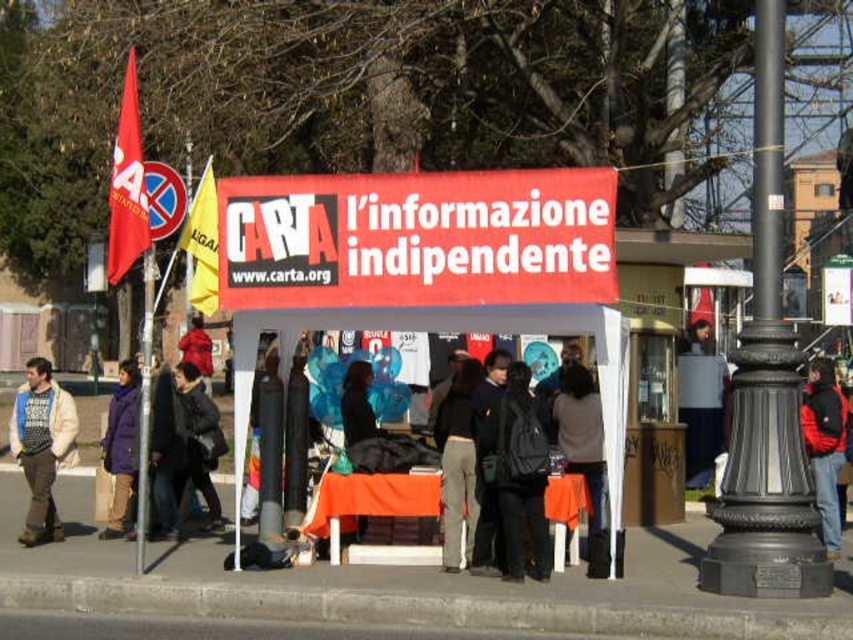
Which is in front, point (194, 483) or point (140, 488)?

Point (140, 488) is more forward.

What are the coordinates of `dark gray jacket at center` in the screenshot? It's located at (199, 440).

Is red fabric sign at center above purple fleece jacket at lower left?

Yes, red fabric sign at center is above purple fleece jacket at lower left.

Image resolution: width=853 pixels, height=640 pixels. What are the coordinates of `red fabric sign at center` in the screenshot? It's located at (416, 237).

Is point (596, 186) positioned in front of point (131, 509)?

Yes, point (596, 186) is closer to viewer.

At what (x,y) coordinates should I click in order to perform the action: click on red fabric sign at center. Please return your answer as a coordinate pair (x, y). Image resolution: width=853 pixels, height=640 pixels. Looking at the image, I should click on (416, 237).

Does dark gray jacket at center appear on the right side of red wool coat at center?

Indeed, dark gray jacket at center is positioned on the right side of red wool coat at center.

Is dark gray jacket at center wider than red wool coat at center?

No.

You are a GUI agent. You are given a task and a screenshot of the screen. Output one action in this format:
    pyautogui.click(x=<x>, y=<y>)
    Task: Click on the dark gray jacket at center
    The width and height of the screenshot is (853, 640).
    Given the screenshot: What is the action you would take?
    pyautogui.click(x=199, y=440)